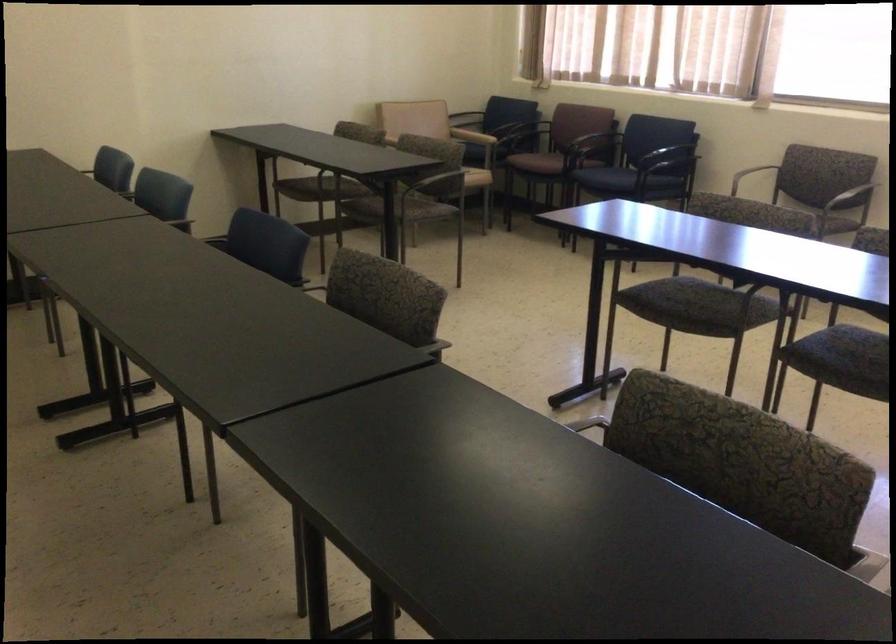
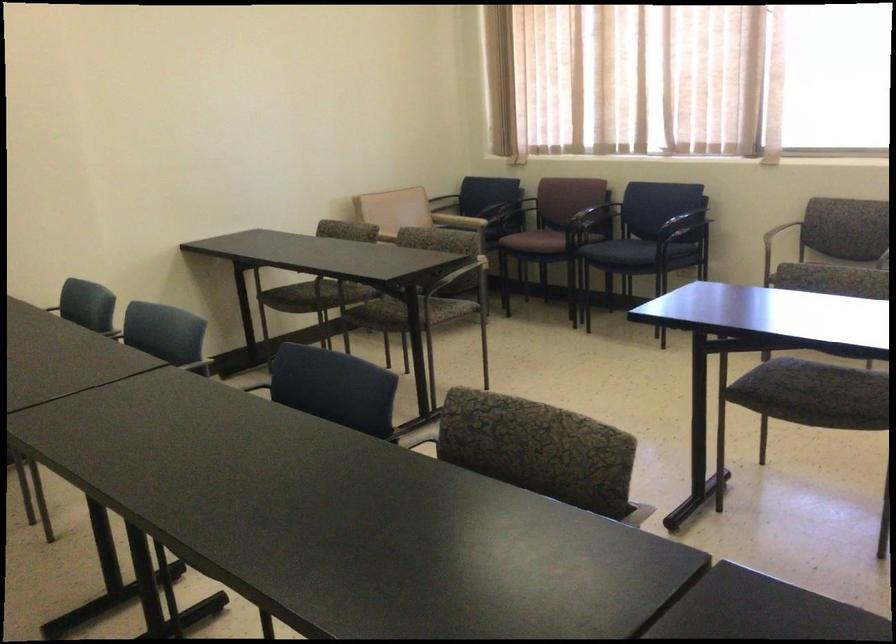
The point at (x=676, y=160) is marked in the first image. Where is the corresponding point in the second image?

(687, 225)